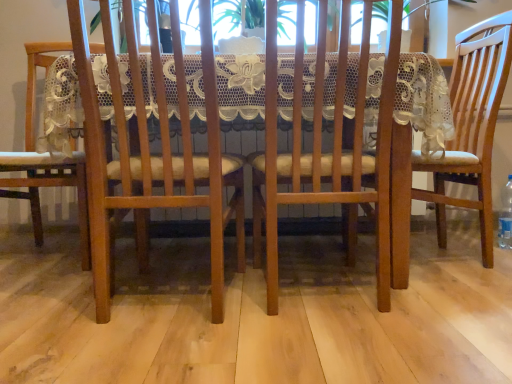
You are a GUI agent. You are given a task and a screenshot of the screen. Output one action in this format:
    pyautogui.click(x=<x>, y=<y>)
    Task: Click on the matte wood chair at right, positioned as the 1th chair in right-to-left order
    
    Given the screenshot: What is the action you would take?
    pyautogui.click(x=472, y=125)

This screenshot has height=384, width=512. What do you see at coordinates (472, 125) in the screenshot?
I see `matte wood chair at right, which appears as the 4th chair when viewed from the left` at bounding box center [472, 125].

What do you see at coordinates (45, 157) in the screenshot? I see `matte wood chair at left, acting as the first chair starting from the left` at bounding box center [45, 157].

Identify the location of matte wood chair at left, acting as the first chair starting from the left. The width and height of the screenshot is (512, 384). (45, 157).

The width and height of the screenshot is (512, 384). In order to click on wooden table at center in this screenshot , I will do `click(423, 99)`.

Is wooden table at center wider than wooden chair at center, which ranks as the second chair in right-to-left order?

Yes, wooden table at center is wider than wooden chair at center, which ranks as the second chair in right-to-left order.

Considering the sizes of objects wooden table at center and wooden chair at center, which ranks as the second chair in right-to-left order, in the image provided, who is shorter, wooden table at center or wooden chair at center, which ranks as the second chair in right-to-left order,?

Standing shorter between the two is wooden table at center.

Is point (156, 180) positioned after point (393, 5)?

That is True.

Is clear plastic bottle at lower right oriented towards matte wood chair at right, positioned as the 1th chair in right-to-left order?

No, clear plastic bottle at lower right does not turn towards matte wood chair at right, positioned as the 1th chair in right-to-left order.

Relative to matte wood chair at right, positioned as the 1th chair in right-to-left order, is clear plastic bottle at lower right in front or behind?

Visually, clear plastic bottle at lower right is located behind matte wood chair at right, positioned as the 1th chair in right-to-left order.

Based on the photo, considering the sizes of clear plastic bottle at lower right and matte wood chair at right, which appears as the 4th chair when viewed from the left, in the image, is clear plastic bottle at lower right taller or shorter than matte wood chair at right, which appears as the 4th chair when viewed from the left,?

clear plastic bottle at lower right is shorter than matte wood chair at right, which appears as the 4th chair when viewed from the left.

From the image's perspective, between clear plastic bottle at lower right and matte wood chair at right, which appears as the 4th chair when viewed from the left, who is located below?

clear plastic bottle at lower right.

Is point (292, 182) closer to viewer compared to point (80, 166)?

Yes.

Relative to matte wood chair at left, acting as the first chair starting from the left, is wooden chair at center, marked as the third chair in a left-to-right arrangement, in front or behind?

wooden chair at center, marked as the third chair in a left-to-right arrangement, is positioned closer to the viewer than matte wood chair at left, acting as the first chair starting from the left.

Based on the photo, what's the angular difference between wooden chair at center, which ranks as the second chair in right-to-left order, and matte wood chair at left, acting as the first chair starting from the left,'s facing directions?

wooden chair at center, which ranks as the second chair in right-to-left order, and matte wood chair at left, acting as the first chair starting from the left, are facing 177 degrees away from each other.

In the scene shown: Is wooden chair at center, marked as the third chair in a left-to-right arrangement, to the left or to the right of matte wood chair at left, the fourth chair viewed from the right, in the image?

wooden chair at center, marked as the third chair in a left-to-right arrangement, is positioned on matte wood chair at left, the fourth chair viewed from the right,'s right side.

From a real-world perspective, which object rests below the other?

wooden chair at center, placed as the second chair when sorted from left to right.

Is wooden chair at center, placed as the second chair when sorted from left to right, looking in the opposite direction of matte wood chair at right, positioned as the 1th chair in right-to-left order?

No, wooden chair at center, placed as the second chair when sorted from left to right,'s orientation is not away from matte wood chair at right, positioned as the 1th chair in right-to-left order.

Can we say wooden chair at center, placed as the second chair when sorted from left to right, lies outside matte wood chair at right, positioned as the 1th chair in right-to-left order?

Absolutely, wooden chair at center, placed as the second chair when sorted from left to right, is external to matte wood chair at right, positioned as the 1th chair in right-to-left order.

From a real-world perspective, does wooden chair at center, marked as the third chair in a left-to-right arrangement, stand above wooden table at center?

Correct, in the physical world, wooden chair at center, marked as the third chair in a left-to-right arrangement, is higher than wooden table at center.

Is wooden chair at center, which ranks as the second chair in right-to-left order, to the right of wooden table at center from the viewer's perspective?

Yes.

From their relative heights in the image, would you say wooden chair at center, marked as the third chair in a left-to-right arrangement, is taller or shorter than wooden table at center?

Clearly, wooden chair at center, marked as the third chair in a left-to-right arrangement, is taller compared to wooden table at center.

From the image's perspective, would you say clear plastic bottle at lower right is positioned over wooden chair at center, placed as the second chair when sorted from left to right?

No, from the image's perspective, clear plastic bottle at lower right is not above wooden chair at center, placed as the second chair when sorted from left to right.

Considering the sizes of clear plastic bottle at lower right and wooden chair at center, which is the 3th chair in right-to-left order, in the image, is clear plastic bottle at lower right taller or shorter than wooden chair at center, which is the 3th chair in right-to-left order,?

clear plastic bottle at lower right is shorter than wooden chair at center, which is the 3th chair in right-to-left order.

Considering the sizes of clear plastic bottle at lower right and wooden chair at center, which is the 3th chair in right-to-left order, in the image, is clear plastic bottle at lower right bigger or smaller than wooden chair at center, which is the 3th chair in right-to-left order,?

Considering their sizes, clear plastic bottle at lower right takes up less space than wooden chair at center, which is the 3th chair in right-to-left order.

Could you tell me if clear plastic bottle at lower right is facing wooden chair at center, placed as the second chair when sorted from left to right?

No, clear plastic bottle at lower right is not aimed at wooden chair at center, placed as the second chair when sorted from left to right.

Is wooden table at center a part of matte wood chair at right, positioned as the 1th chair in right-to-left order?

No, wooden table at center is not a part of matte wood chair at right, positioned as the 1th chair in right-to-left order.

Is matte wood chair at right, which appears as the 4th chair when viewed from the left, positioned with its back to wooden table at center?

No, matte wood chair at right, which appears as the 4th chair when viewed from the left,'s orientation is not away from wooden table at center.

From the image's perspective, would you say matte wood chair at right, which appears as the 4th chair when viewed from the left, is positioned over wooden table at center?

Yes, from the image's perspective, matte wood chair at right, which appears as the 4th chair when viewed from the left, is above wooden table at center.

In order to click on chair that is the 1st object located behind the wooden table at center in this screenshot , I will do `click(472, 125)`.

Image resolution: width=512 pixels, height=384 pixels. I want to click on table below the wooden chair at center, which ranks as the second chair in right-to-left order (from the image's perspective), so click(x=423, y=99).

This screenshot has height=384, width=512. Find the location of `chair that is the 2nd object located in front of the clear plastic bottle at lower right`. chair that is the 2nd object located in front of the clear plastic bottle at lower right is located at coordinates (472, 125).

Based on their spatial positions, is wooden chair at center, which ranks as the second chair in right-to-left order, or wooden chair at center, which is the 3th chair in right-to-left order, closer to clear plastic bottle at lower right?

Based on the image, wooden chair at center, which ranks as the second chair in right-to-left order, appears to be nearer to clear plastic bottle at lower right.

When comparing their distances from matte wood chair at left, acting as the first chair starting from the left, does wooden chair at center, which ranks as the second chair in right-to-left order, or wooden chair at center, which is the 3th chair in right-to-left order, seem closer?

The object closer to matte wood chair at left, acting as the first chair starting from the left, is wooden chair at center, which is the 3th chair in right-to-left order.

From the image, which object appears to be nearer to matte wood chair at left, the fourth chair viewed from the right, matte wood chair at right, positioned as the 1th chair in right-to-left order, or wooden table at center?

wooden table at center is positioned closer to the anchor matte wood chair at left, the fourth chair viewed from the right.

Looking at the image, which one is located closer to clear plastic bottle at lower right, matte wood chair at right, positioned as the 1th chair in right-to-left order, or wooden chair at center, which ranks as the second chair in right-to-left order?

matte wood chair at right, positioned as the 1th chair in right-to-left order.

When comparing their distances from wooden chair at center, placed as the second chair when sorted from left to right, does wooden table at center or clear plastic bottle at lower right seem closer?

Among the two, wooden table at center is located nearer to wooden chair at center, placed as the second chair when sorted from left to right.

Which object lies further to the anchor point wooden chair at center, which ranks as the second chair in right-to-left order, wooden table at center or matte wood chair at right, which appears as the 4th chair when viewed from the left?

matte wood chair at right, which appears as the 4th chair when viewed from the left, is further to wooden chair at center, which ranks as the second chair in right-to-left order.

Based on their spatial positions, is wooden chair at center, marked as the third chair in a left-to-right arrangement, or wooden chair at center, placed as the second chair when sorted from left to right, further from matte wood chair at right, which appears as the 4th chair when viewed from the left?

wooden chair at center, placed as the second chair when sorted from left to right, is positioned further to the anchor matte wood chair at right, which appears as the 4th chair when viewed from the left.

Considering their positions, is wooden chair at center, which is the 3th chair in right-to-left order, positioned closer to clear plastic bottle at lower right than matte wood chair at left, acting as the first chair starting from the left?

wooden chair at center, which is the 3th chair in right-to-left order, lies closer to clear plastic bottle at lower right than the other object.

Find the location of a particular element. The height and width of the screenshot is (384, 512). table between matte wood chair at left, acting as the first chair starting from the left, and wooden chair at center, marked as the third chair in a left-to-right arrangement is located at coordinates (423, 99).

Image resolution: width=512 pixels, height=384 pixels. I want to click on table between wooden chair at center, placed as the second chair when sorted from left to right, and matte wood chair at right, positioned as the 1th chair in right-to-left order, in the horizontal direction, so click(423, 99).

You are a GUI agent. You are given a task and a screenshot of the screen. Output one action in this format:
    pyautogui.click(x=<x>, y=<y>)
    Task: Click on the chair between wooden chair at center, marked as the third chair in a left-to-right arrangement, and clear plastic bottle at lower right, in the horizontal direction
    The image size is (512, 384).
    Given the screenshot: What is the action you would take?
    tap(472, 125)

Locate an element on the screen. The height and width of the screenshot is (384, 512). chair between wooden table at center and matte wood chair at right, which appears as the 4th chair when viewed from the left, from left to right is located at coordinates (335, 147).